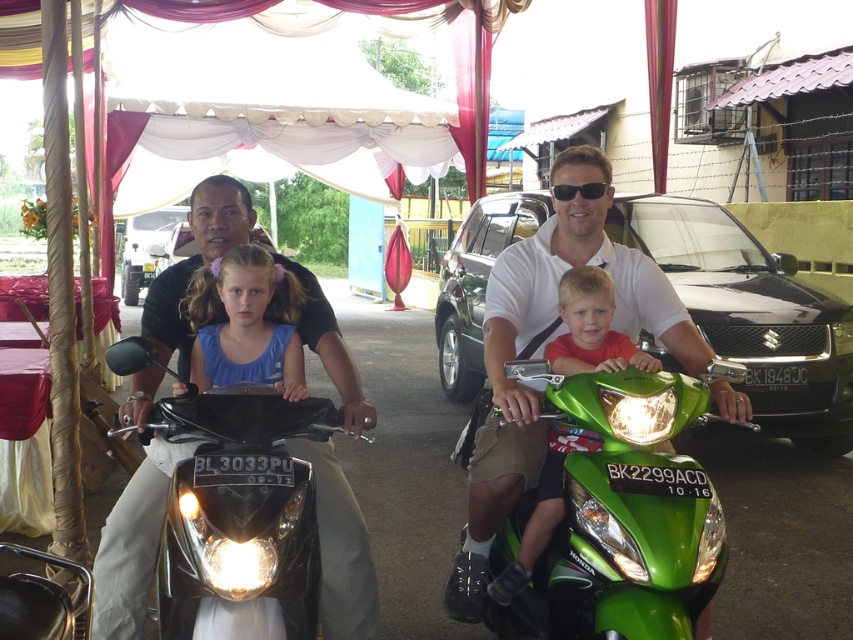
Question: Is matte green motorcycle at center in front of black plastic sunglasses at center?

Choices:
 (A) no
 (B) yes

Answer: (B)

Question: Does green glossy motorcycle at center appear on the left side of black glossy motorcycle at center?

Choices:
 (A) no
 (B) yes

Answer: (A)

Question: Among these points, which one is farthest from the camera?

Choices:
 (A) (244, 307)
 (B) (636, 348)
 (C) (550, 192)
 (D) (815, 337)

Answer: (D)

Question: Among these objects, which one is farthest from the camera?

Choices:
 (A) black metallic car at center
 (B) red matte shirt at center

Answer: (A)

Question: Does black metallic car at center come behind black plastic sunglasses at center?

Choices:
 (A) no
 (B) yes

Answer: (B)

Question: Among these objects, which one is farthest from the camera?

Choices:
 (A) black metallic car at center
 (B) black plastic sunglasses at center
 (C) matte green motorcycle at center

Answer: (A)